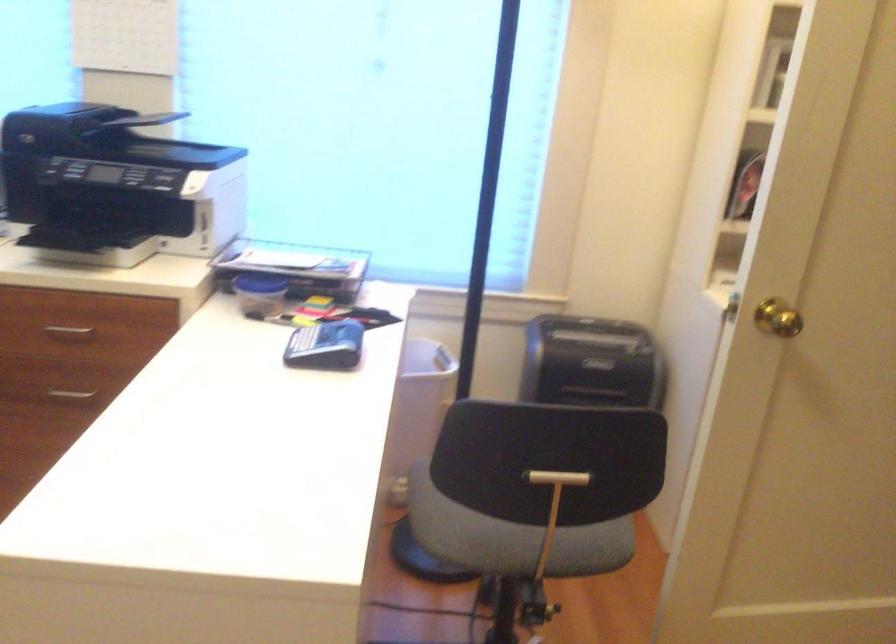
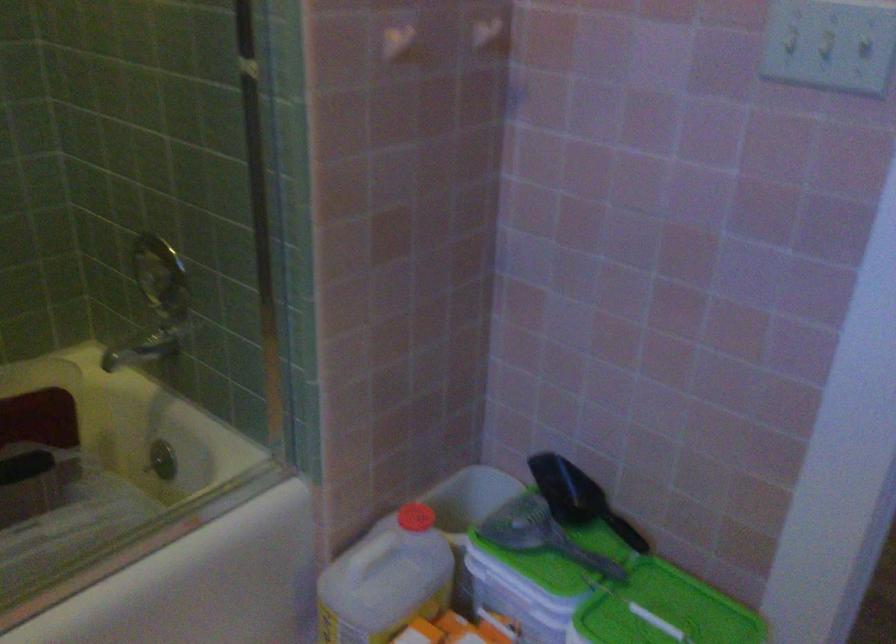
Question: I am providing you with two images of the same scene from different viewpoints. Which of the following objects are not visible in image2?

Choices:
 (A) silver drawer handle
 (B) black scoop handle
 (C) red bottle cap
 (D) black footstool

Answer: (A)